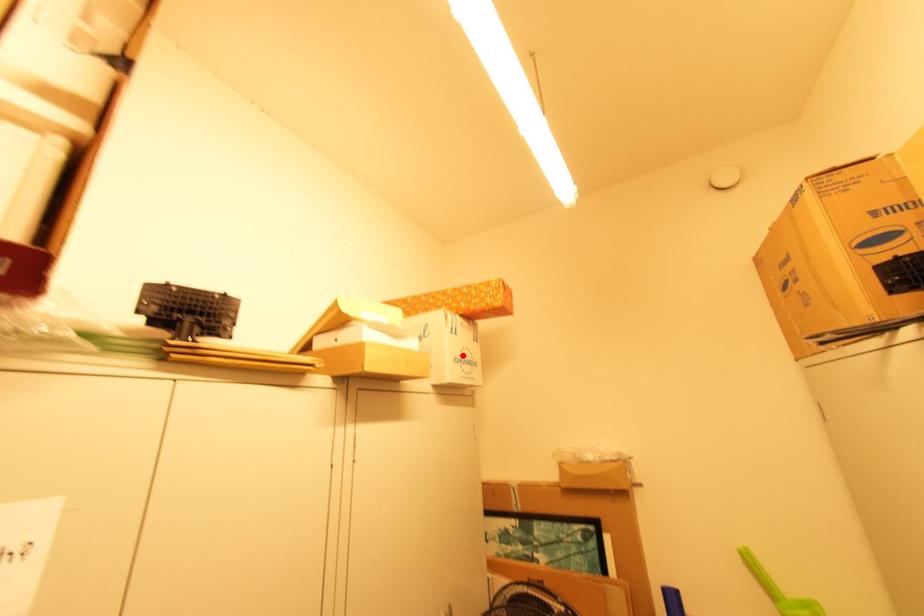
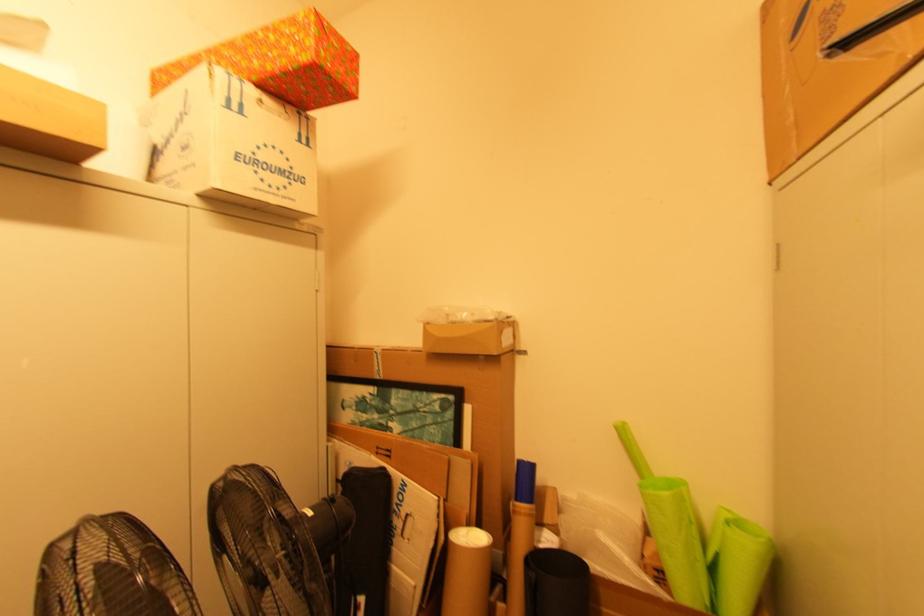
Where in the second image is the point corresponding to the highlighted location from the first image?

(257, 154)